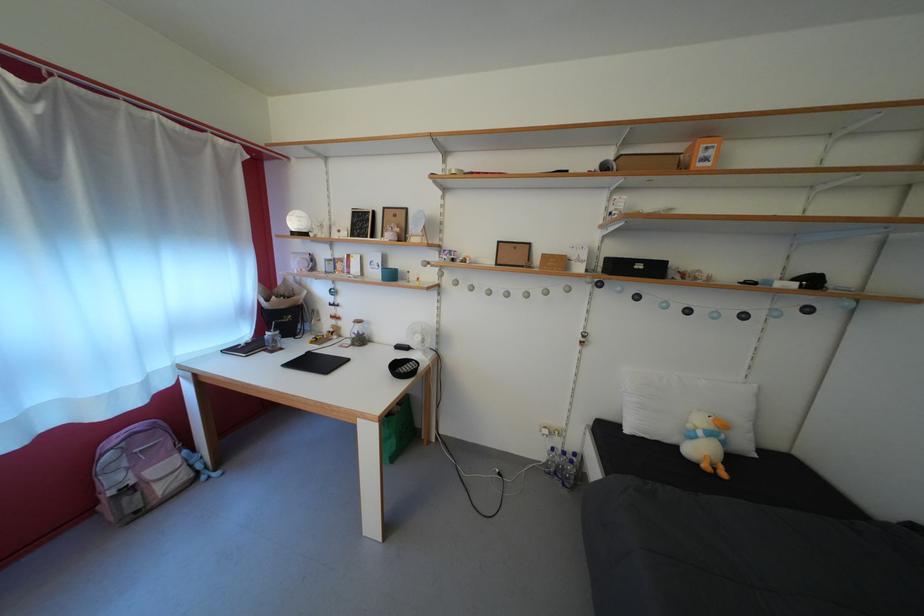
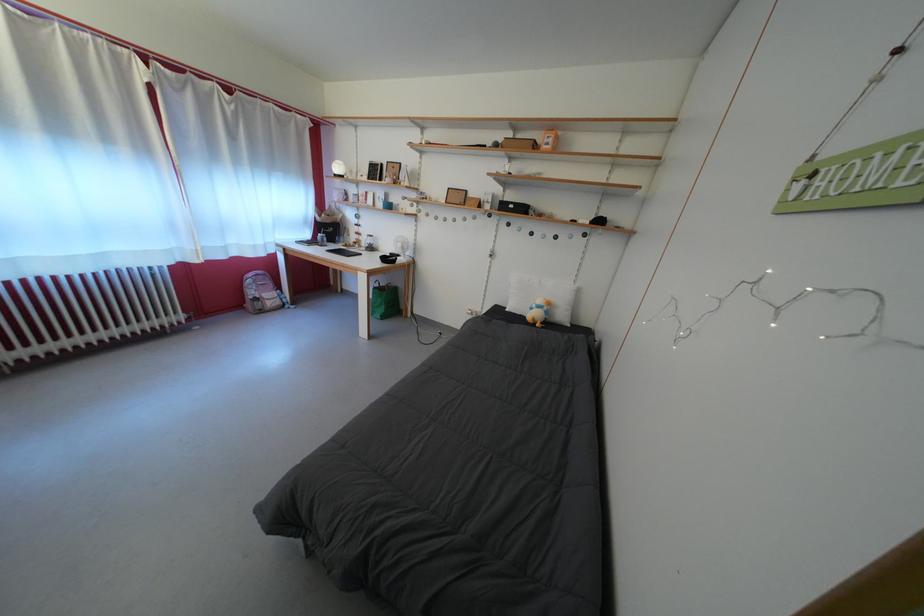
Where in the second image is the point corresponding to (x=732, y=448) from the first image?

(554, 318)